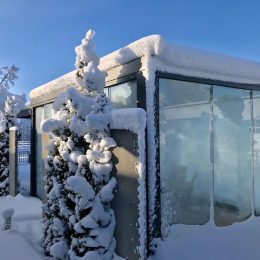
Locate an element on the screen. The width and height of the screenshot is (260, 260). wall is located at coordinates (122, 202).